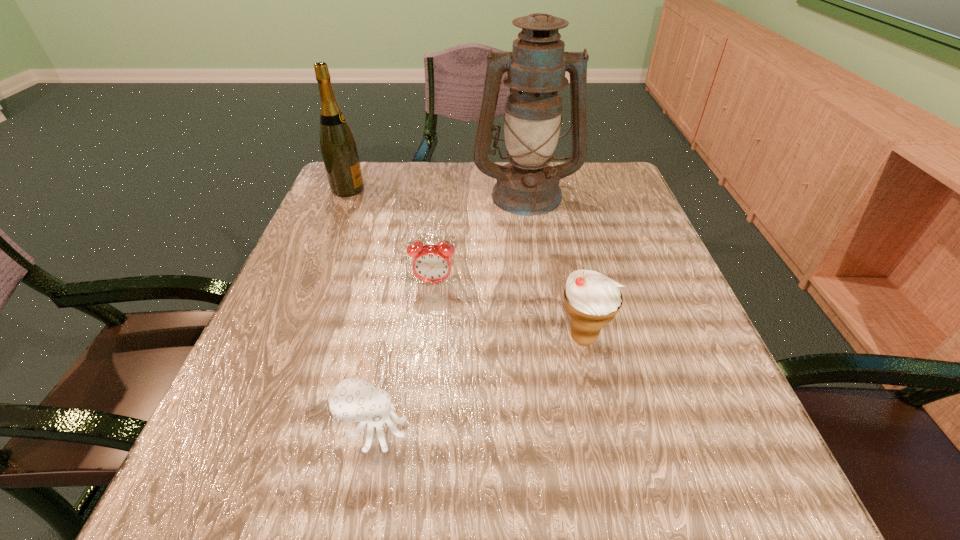
You are a GUI agent. You are given a task and a screenshot of the screen. Output one action in this format:
    pyautogui.click(x=<x>, y=<y>)
    Task: Click on the vacant area located 0.360m on the face of the alarm clock
    The height and width of the screenshot is (540, 960).
    Given the screenshot: What is the action you would take?
    pyautogui.click(x=410, y=487)

At what (x,y) coordinates should I click in order to perform the action: click on free location located on the front-facing side of the nearest object. Please return your answer as a coordinate pair (x, y). Looking at the image, I should click on (443, 429).

At what (x,y) coordinates should I click in order to perform the action: click on oil lamp located at the far edge. Please return your answer as a coordinate pair (x, y). Looking at the image, I should click on (536, 67).

This screenshot has height=540, width=960. What are the coordinates of `wine bottle located in the far edge section of the desktop` in the screenshot? It's located at (338, 147).

The width and height of the screenshot is (960, 540). Identify the location of object located in the near edge section of the desktop. (352, 400).

The image size is (960, 540). Find the location of `object that is positioned at the left edge`. object that is positioned at the left edge is located at coordinates (338, 147).

Where is `oil lamp that is positioned at the right edge`? The image size is (960, 540). oil lamp that is positioned at the right edge is located at coordinates (536, 67).

Locate an element on the screen. icecream located at the right edge is located at coordinates (592, 300).

I want to click on object located in the far left corner section of the desktop, so [338, 147].

Where is `object present at the far right corner`? Image resolution: width=960 pixels, height=540 pixels. object present at the far right corner is located at coordinates (536, 67).